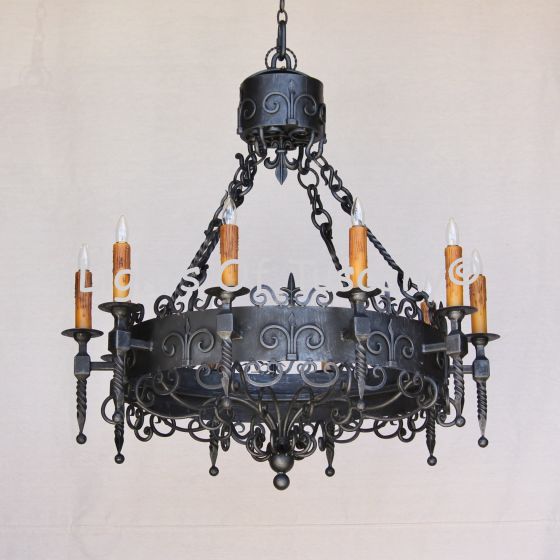
Where is `top chain of light`? top chain of light is located at coordinates (280, 8).